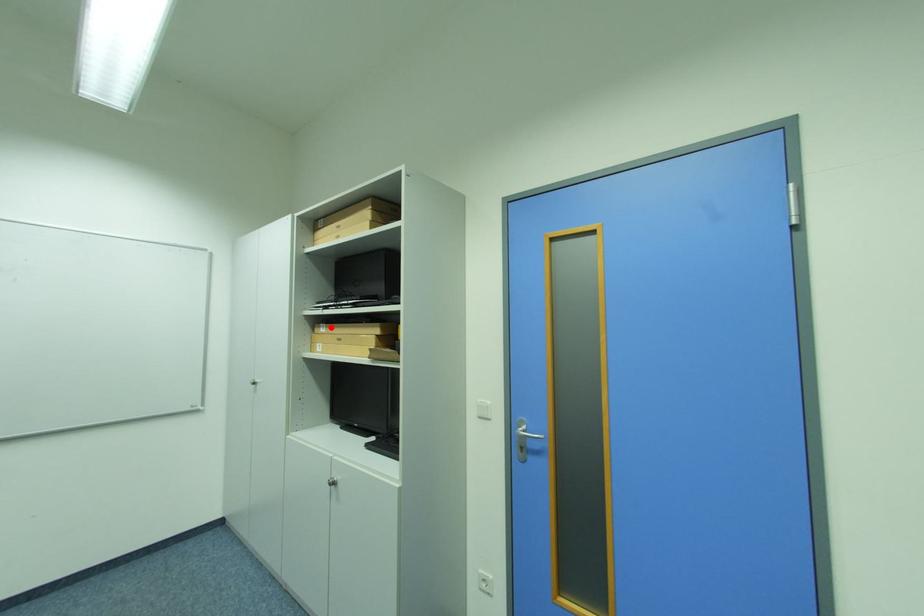
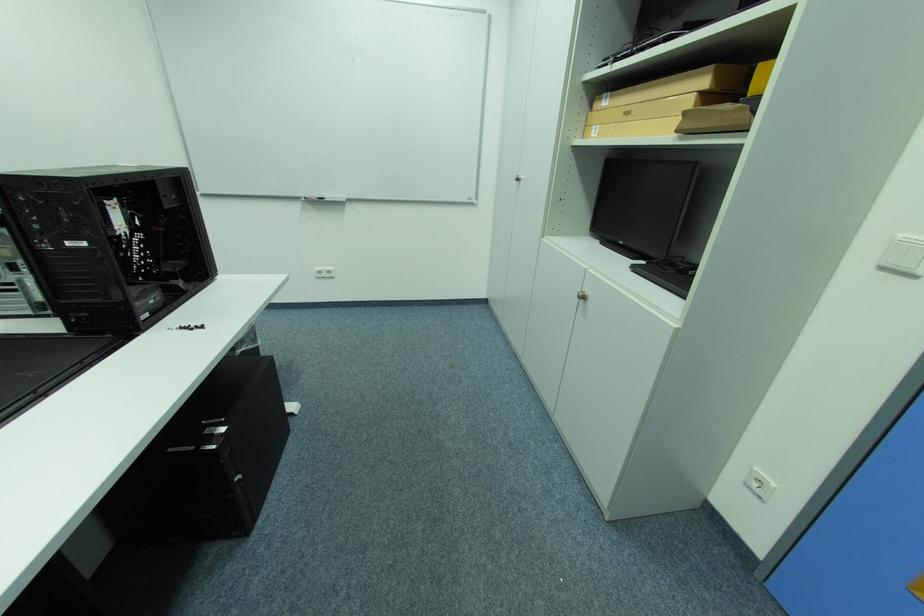
In the second image, find the point that corresponds to the highlighted location in the first image.

(614, 98)